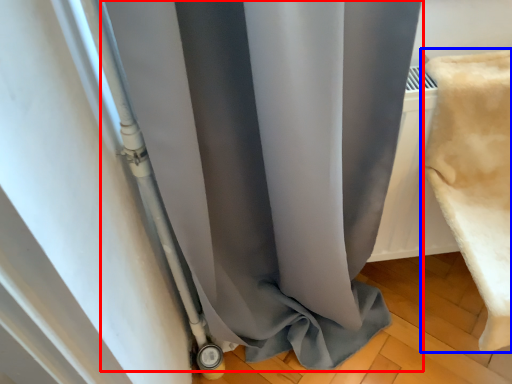
Question: Which point is further to the camera, curtain (highlighted by a red box) or material (highlighted by a blue box)?

Choices:
 (A) curtain
 (B) material

Answer: (B)